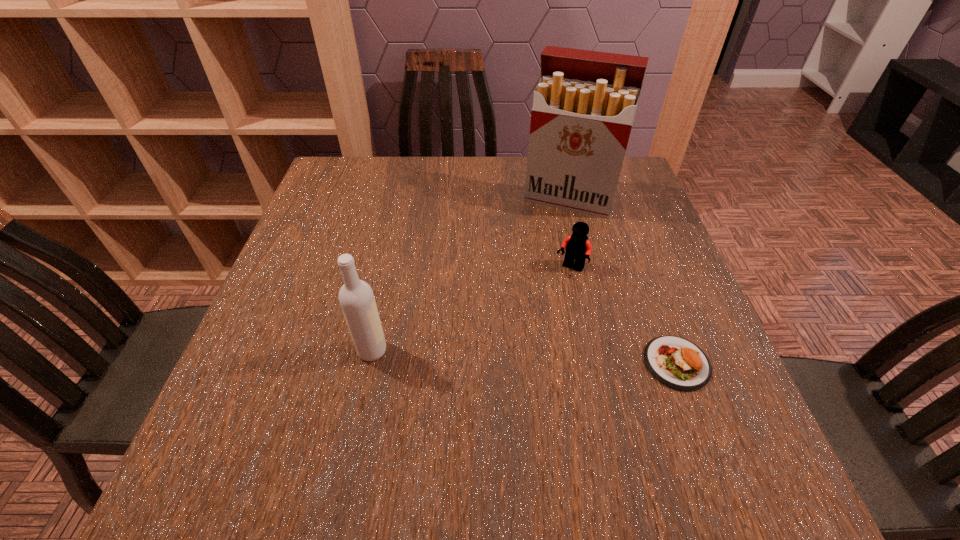
Find the location of `the second tallest object`. the second tallest object is located at coordinates (356, 297).

The image size is (960, 540). I want to click on vodka, so click(356, 297).

What are the coordinates of `the shortest object` in the screenshot? It's located at (678, 363).

Locate an element on the screen. This screenshot has height=540, width=960. the third tallest object is located at coordinates (577, 246).

In order to click on Lego in this screenshot , I will do `click(577, 246)`.

This screenshot has width=960, height=540. What are the coordinates of `the farthest object` in the screenshot? It's located at (584, 105).

The width and height of the screenshot is (960, 540). What are the coordinates of `cigarette case` in the screenshot? It's located at (584, 105).

Locate an element on the screen. Image resolution: width=960 pixels, height=540 pixels. vacant space located on the back of the vodka is located at coordinates (400, 214).

The width and height of the screenshot is (960, 540). I want to click on vacant space located 0.340m on the back of the shortest object, so (x=626, y=228).

Identify the location of free location located 0.140m on the front-facing side of the third tallest object. This screenshot has height=540, width=960. (537, 319).